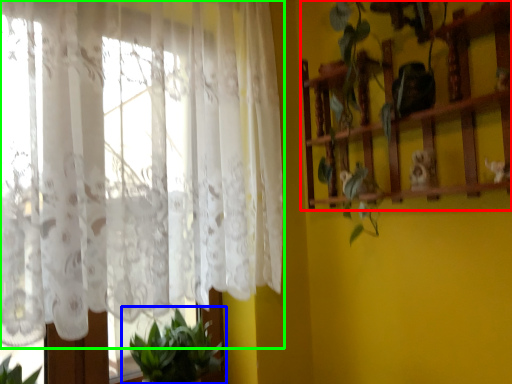
Question: Which object is positioned farthest from shelf (highlighted by a red box)? Select from houseplant (highlighted by a blue box) and curtain (highlighted by a green box).

Choices:
 (A) houseplant
 (B) curtain

Answer: (A)